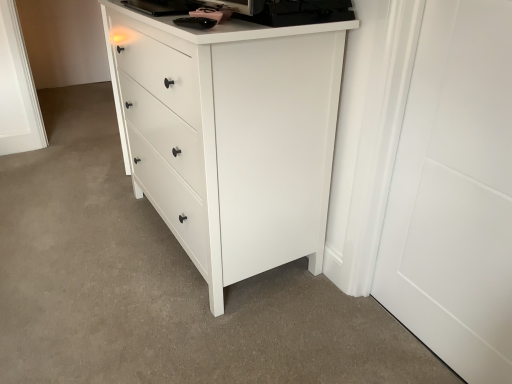
Question: Can you confirm if white matte chest of drawers at center is wider than white matte door at right?

Choices:
 (A) no
 (B) yes

Answer: (B)

Question: From a real-world perspective, is white matte chest of drawers at center located beneath white matte door at right?

Choices:
 (A) no
 (B) yes

Answer: (B)

Question: Does white matte chest of drawers at center have a larger size compared to white matte door at right?

Choices:
 (A) yes
 (B) no

Answer: (A)

Question: Is white matte chest of drawers at center not close to white matte door at right?

Choices:
 (A) yes
 (B) no

Answer: (B)

Question: Can you confirm if white matte chest of drawers at center is shorter than white matte door at right?

Choices:
 (A) yes
 (B) no

Answer: (A)

Question: Can you confirm if white matte chest of drawers at center is thinner than white matte door at right?

Choices:
 (A) yes
 (B) no

Answer: (B)

Question: Is white matte door at right located outside white matte chest of drawers at center?

Choices:
 (A) no
 (B) yes

Answer: (B)

Question: Does white matte door at right have a greater width compared to white matte chest of drawers at center?

Choices:
 (A) no
 (B) yes

Answer: (A)

Question: Does white matte door at right have a lesser height compared to white matte chest of drawers at center?

Choices:
 (A) yes
 (B) no

Answer: (B)

Question: From the image's perspective, does white matte door at right appear lower than white matte chest of drawers at center?

Choices:
 (A) yes
 (B) no

Answer: (A)

Question: Does white matte door at right have a lesser width compared to white matte chest of drawers at center?

Choices:
 (A) yes
 (B) no

Answer: (A)

Question: From the image's perspective, would you say white matte door at right is positioned over white matte chest of drawers at center?

Choices:
 (A) yes
 (B) no

Answer: (B)

Question: Is point (326, 56) closer or farther from the camera than point (471, 198)?

Choices:
 (A) closer
 (B) farther

Answer: (B)